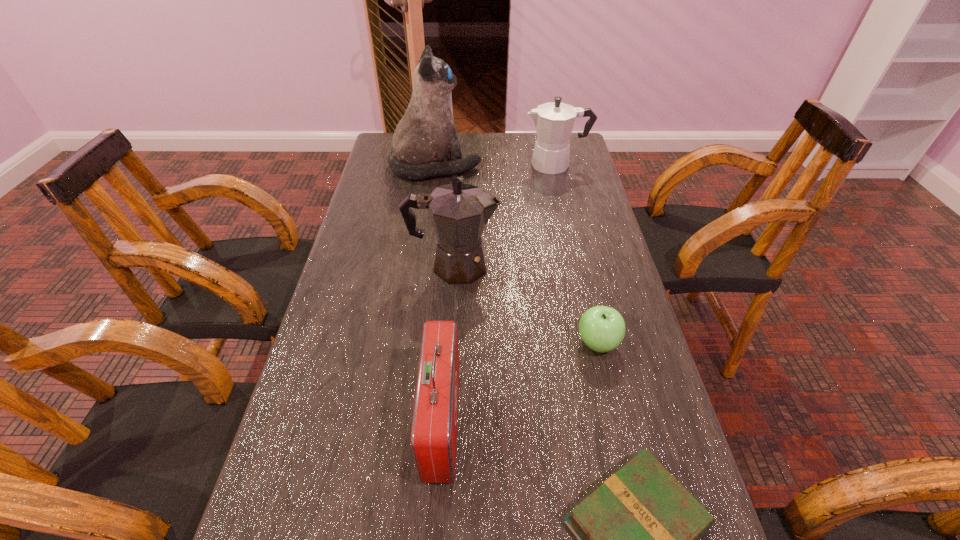
Where is `free point located 0.360m at the spout of the right coffeepot`? free point located 0.360m at the spout of the right coffeepot is located at coordinates click(x=420, y=165).

Find the location of `vacant point located at the spout of the right coffeepot`. vacant point located at the spout of the right coffeepot is located at coordinates (510, 165).

Locate an element on the screen. Image resolution: width=960 pixels, height=540 pixels. free space located 0.380m on the side of the first-aid kit with the first aid cross symbol is located at coordinates (652, 422).

Identify the location of vacant space located 0.330m on the back of the third nearest object. This screenshot has height=540, width=960. (572, 235).

Where is `cat located in the far edge section of the desktop`? This screenshot has height=540, width=960. cat located in the far edge section of the desktop is located at coordinates (425, 136).

This screenshot has width=960, height=540. What are the coordinates of `coffeepot located at the far edge` in the screenshot? It's located at point(554,121).

I want to click on object located at the left edge, so click(x=425, y=136).

Find the location of a particular element. coffeepot that is at the right edge is located at coordinates (554, 121).

You are a GUI agent. You are given a task and a screenshot of the screen. Output one action in this format:
    pyautogui.click(x=<x>, y=<y>)
    Task: Click on the apple that is positioned at the right edge
    The height and width of the screenshot is (540, 960).
    Given the screenshot: What is the action you would take?
    [x=602, y=328]

At what (x,y) coordinates should I click in order to perform the action: click on object situated at the far left corner. Please return your answer as a coordinate pair (x, y). Looking at the image, I should click on (425, 136).